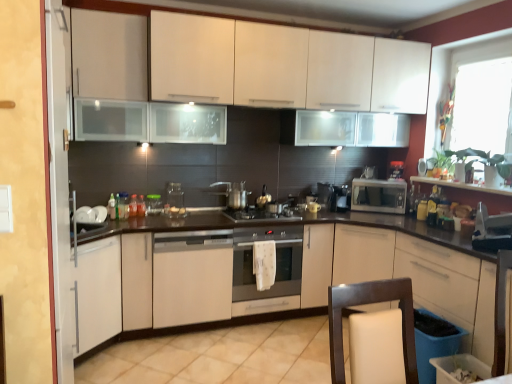
Where is `blank space above transparent glass window at upper right (from a real-world perspective)`? This screenshot has height=384, width=512. blank space above transparent glass window at upper right (from a real-world perspective) is located at coordinates tap(485, 64).